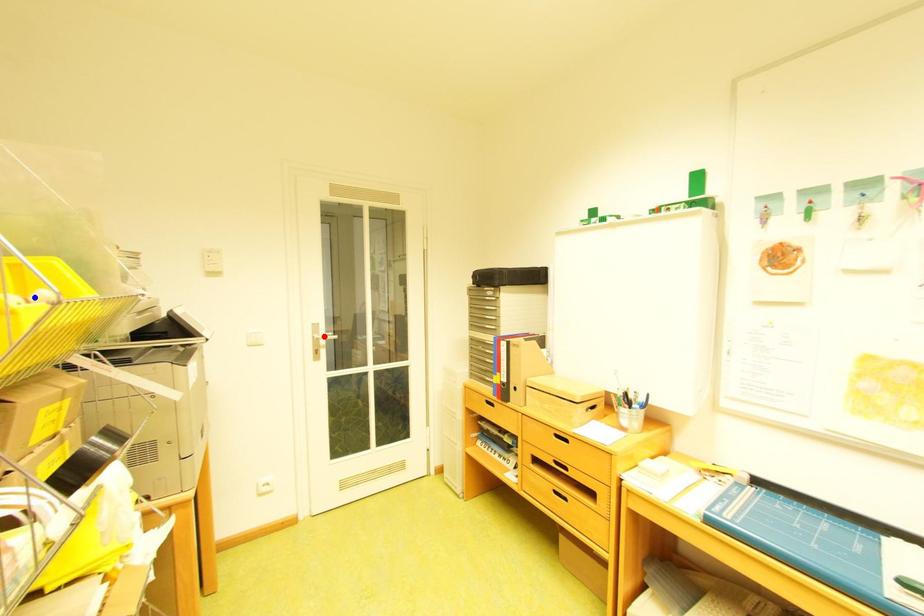
Question: In the image, two points are highlighted. Which point is nearer to the camera? Reply with the corresponding letter.

Choices:
 (A) blue point
 (B) red point

Answer: (A)